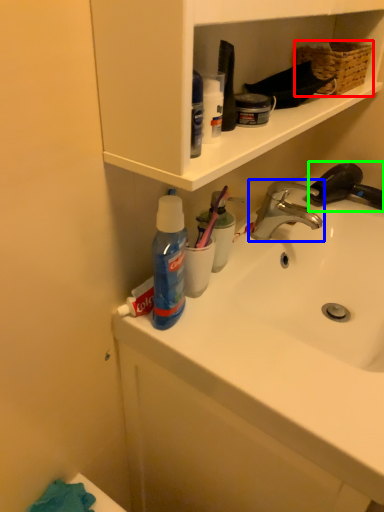
Question: Which is farther away from basket (highlighted by a red box)? tap (highlighted by a blue box) or faucet (highlighted by a green box)?

Choices:
 (A) tap
 (B) faucet

Answer: (A)